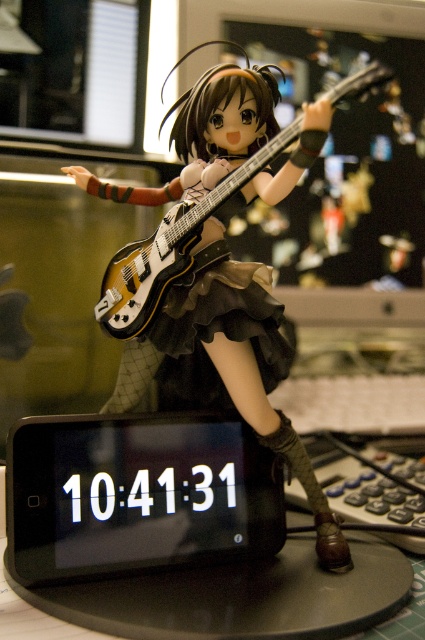
Is matte black guitar at center to the left of matte yellow electric guitar at center from the viewer's perspective?

Incorrect, matte black guitar at center is not on the left side of matte yellow electric guitar at center.

Is point (218, 100) closer to viewer compared to point (144, 280)?

Yes.

Image resolution: width=425 pixels, height=640 pixels. I want to click on matte black guitar at center, so click(238, 369).